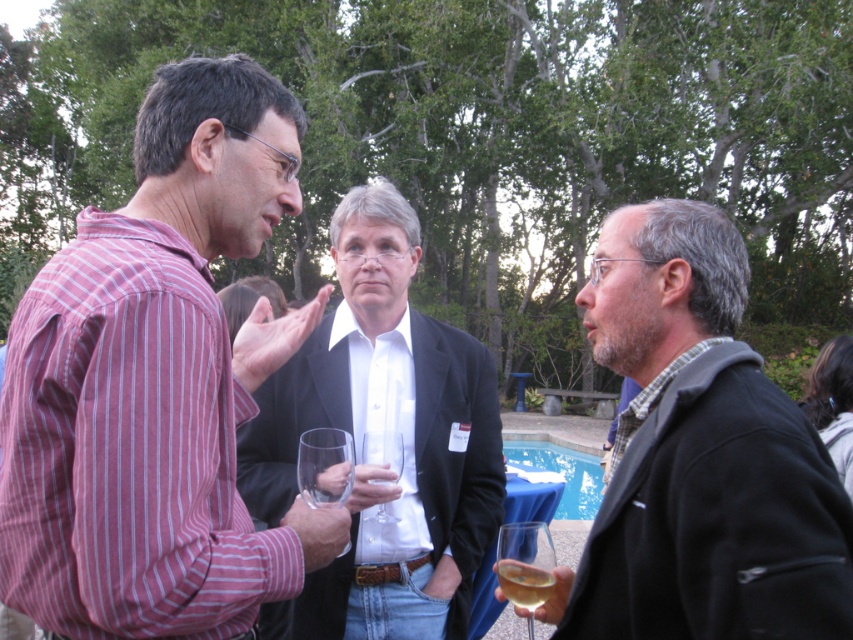
You are a photographer trying to capture a candid shot of the striped cotton shirt at left and the clear glass wine glass at center. Given that your camera has a maximum focus range of 50 centimeters, will you be able to capture both subjects in focus without moving the camera?

The distance between the striped cotton shirt at left and the clear glass wine glass at center is 57.04 centimeters, which exceeds the camera maximum focus range of 50 centimeters. Therefore, you cannot capture both subjects in focus without moving the camera.